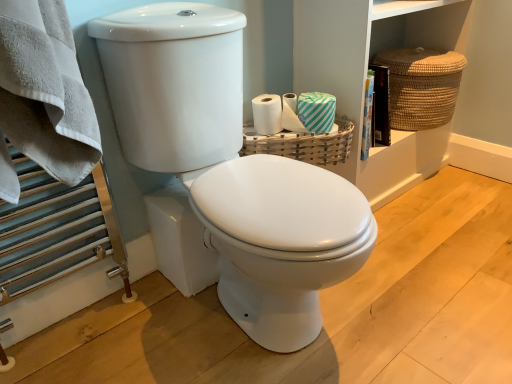
The image size is (512, 384). Identify the location of free spot to the right of white glossy toilet at center, which is the first toilet from back to front. (408, 266).